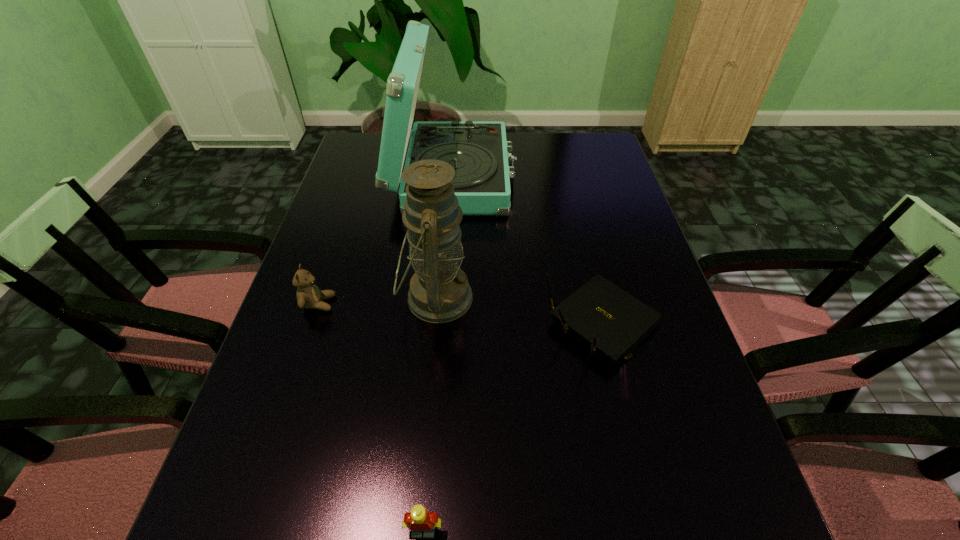
This screenshot has height=540, width=960. I want to click on vacant space that satisfies the following two spatial constraints: 1. on the face side of the record player; 2. on the front-facing side of the Lego, so click(426, 531).

Where is `blank area in the image that satisfies the following two spatial constraints: 1. on the back side of the rightmost object; 2. on the front-facing side of the leftmost object`? blank area in the image that satisfies the following two spatial constraints: 1. on the back side of the rightmost object; 2. on the front-facing side of the leftmost object is located at coordinates point(599,303).

At what (x,y) coordinates should I click in order to perform the action: click on blank area in the image that satisfies the following two spatial constraints: 1. on the face side of the farthest object; 2. on the front-facing side of the Lego. Please return your answer as a coordinate pair (x, y). The image size is (960, 540). Looking at the image, I should click on (426, 531).

You are a GUI agent. You are given a task and a screenshot of the screen. Output one action in this format:
    pyautogui.click(x=<x>, y=<y>)
    Task: Click on the vacant space that satisfies the following two spatial constraints: 1. on the front-facing side of the leftmost object; 2. on the right side of the rightmost object
    This screenshot has height=540, width=960.
    Given the screenshot: What is the action you would take?
    pyautogui.click(x=312, y=323)

In order to click on vacant space that satisfies the following two spatial constraints: 1. on the face side of the farthest object; 2. on the back side of the router in this screenshot , I will do point(442,323).

In order to click on vacant position in the image that satisfies the following two spatial constraints: 1. on the front side of the router; 2. on the left side of the oil lamp in this screenshot , I will do `click(434, 323)`.